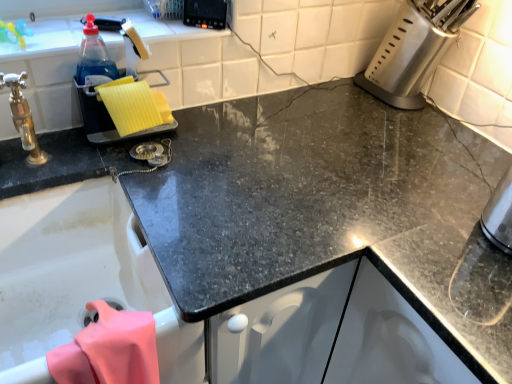
Question: Based on their positions, is satin silver knife block at upper right, which appears as the 3th appliance when viewed from the left, located to the left or right of black plastic control panel at upper center, placed as the 2th appliance when sorted from left to right?

Choices:
 (A) right
 (B) left

Answer: (A)

Question: Is satin silver knife block at upper right, the 1th appliance when ordered from right to left, in front of or behind black plastic control panel at upper center, placed as the 2th appliance when sorted from left to right, in the image?

Choices:
 (A) front
 (B) behind

Answer: (A)

Question: Considering the real-world distances, which object is farthest from the black plastic control panel at upper center, placed as the 2th appliance when sorted from left to right?

Choices:
 (A) pink fabric at lower left
 (B) satin silver knife block at upper right, which appears as the 3th appliance when viewed from the left
 (C) yellow sponge at left, marked as the third appliance in a right-to-left arrangement

Answer: (A)

Question: Which object is the closest to the yellow sponge at left, which is the 1th appliance in left-to-right order?

Choices:
 (A) pink fabric at lower left
 (B) satin silver knife block at upper right, the 1th appliance when ordered from right to left
 (C) black plastic control panel at upper center, placed as the 2th appliance when sorted from left to right

Answer: (C)